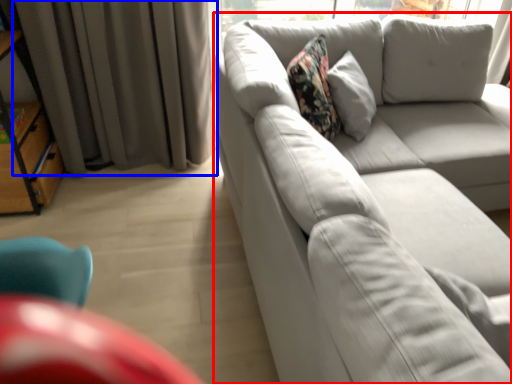
Question: Which object appears closest to the camera in this image, studio couch (highlighted by a red box) or curtain (highlighted by a blue box)?

Choices:
 (A) studio couch
 (B) curtain

Answer: (A)